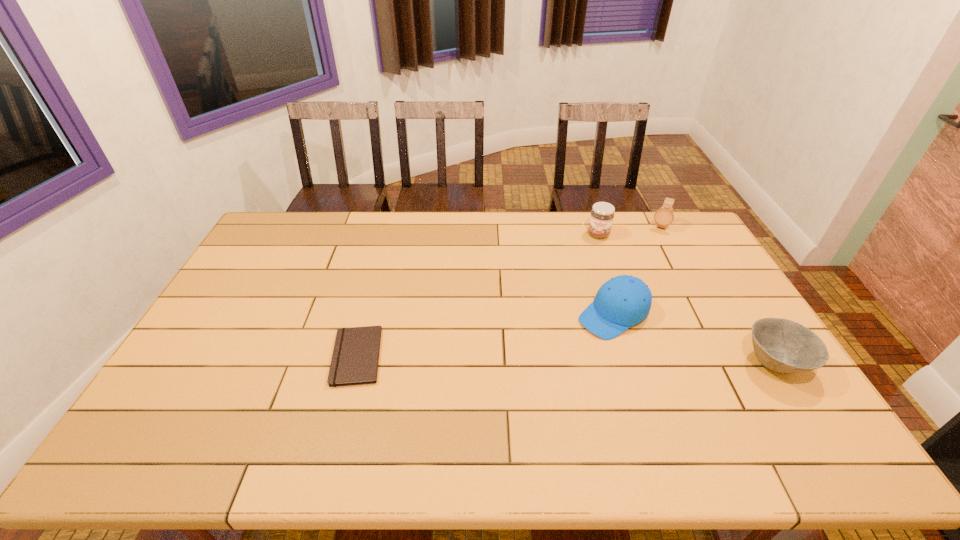
What are the coordinates of `free space between the fourth tallest object and the jam` in the screenshot? It's located at (686, 299).

Find the location of a particular element. The image size is (960, 540). vacant space that is in between the second shortest object and the jam is located at coordinates (686, 299).

Where is `vacant area that lies between the bowl and the jam`? The height and width of the screenshot is (540, 960). vacant area that lies between the bowl and the jam is located at coordinates (686, 299).

Locate an element on the screen. The height and width of the screenshot is (540, 960). unoccupied area between the checkbook and the watch is located at coordinates (509, 292).

Identify the location of blank region between the second shortest object and the jam. The width and height of the screenshot is (960, 540). (686, 299).

The image size is (960, 540). In order to click on free spot between the leftmost object and the cap in this screenshot , I will do `click(485, 336)`.

In order to click on free space between the bowl and the cap in this screenshot , I will do `click(694, 339)`.

The height and width of the screenshot is (540, 960). I want to click on vacant space that's between the cap and the watch, so click(636, 271).

This screenshot has height=540, width=960. What are the coordinates of `vacant area that lies between the watch and the bowl` in the screenshot? It's located at (717, 294).

Select which object is the fourth closest to the watch. Please provide its 2D coordinates. Your answer should be formatted as a tuple, i.e. [(x, y)], where the tuple contains the x and y coordinates of a point satisfying the conditions above.

[(355, 358)]